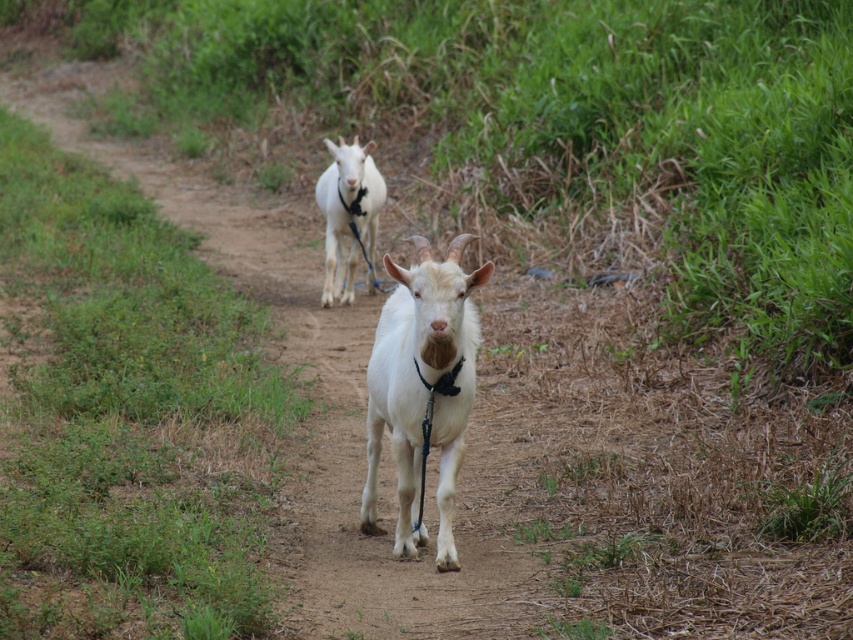
Question: Among these objects, which one is farthest from the camera?

Choices:
 (A) white soft fur goat at center
 (B) white matte goat at center

Answer: (A)

Question: Can you confirm if white matte goat at center is thinner than white soft fur goat at center?

Choices:
 (A) no
 (B) yes

Answer: (B)

Question: Does white matte goat at center have a greater width compared to white soft fur goat at center?

Choices:
 (A) no
 (B) yes

Answer: (A)

Question: Is white matte goat at center thinner than white soft fur goat at center?

Choices:
 (A) no
 (B) yes

Answer: (B)

Question: Which point is closer to the camera?

Choices:
 (A) white soft fur goat at center
 (B) white matte goat at center

Answer: (B)